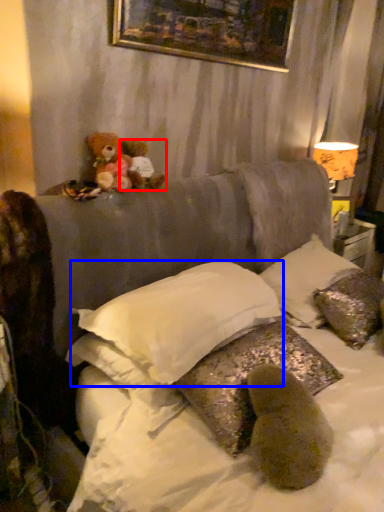
Question: Which object is further to the camera taking this photo, teddy bear (highlighted by a red box) or pillow (highlighted by a blue box)?

Choices:
 (A) teddy bear
 (B) pillow

Answer: (A)